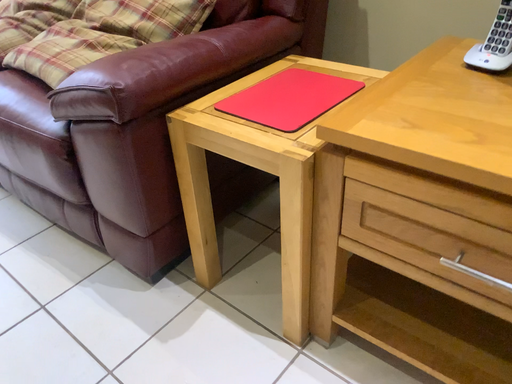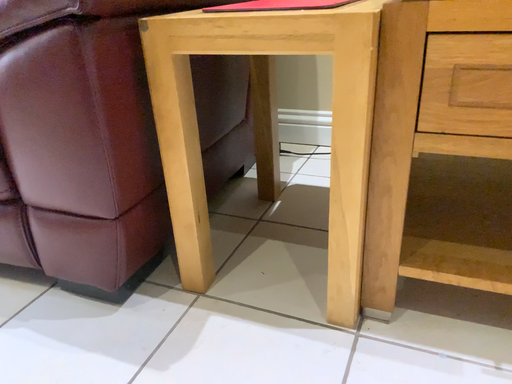
Question: Which way did the camera rotate in the video?

Choices:
 (A) rotated upward
 (B) rotated downward

Answer: (A)